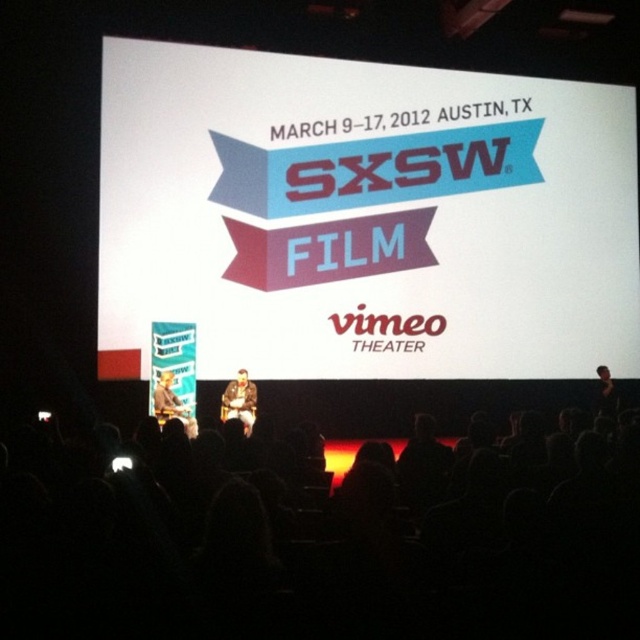
Question: Which point is closer to the camera?

Choices:
 (A) (472, 557)
 (B) (337, 100)

Answer: (A)

Question: Observing the image, what is the correct spatial positioning of white paper at center in reference to black fabric at right?

Choices:
 (A) below
 (B) above

Answer: (B)

Question: Estimate the real-world distances between objects in this image. Which object is closer to the white paper at center?

Choices:
 (A) brown leather jacket at center
 (B) black fabric at right
 (C) black fabric at lower center

Answer: (A)

Question: Estimate the real-world distances between objects in this image. Which object is closer to the black fabric at lower center?

Choices:
 (A) black fabric at right
 (B) brown leather jacket at center
 (C) white paper at center

Answer: (B)

Question: Is white paper at center wider than brown leather jacket at center?

Choices:
 (A) yes
 (B) no

Answer: (A)

Question: Is white paper at center bigger than black fabric at lower center?

Choices:
 (A) no
 (B) yes

Answer: (B)